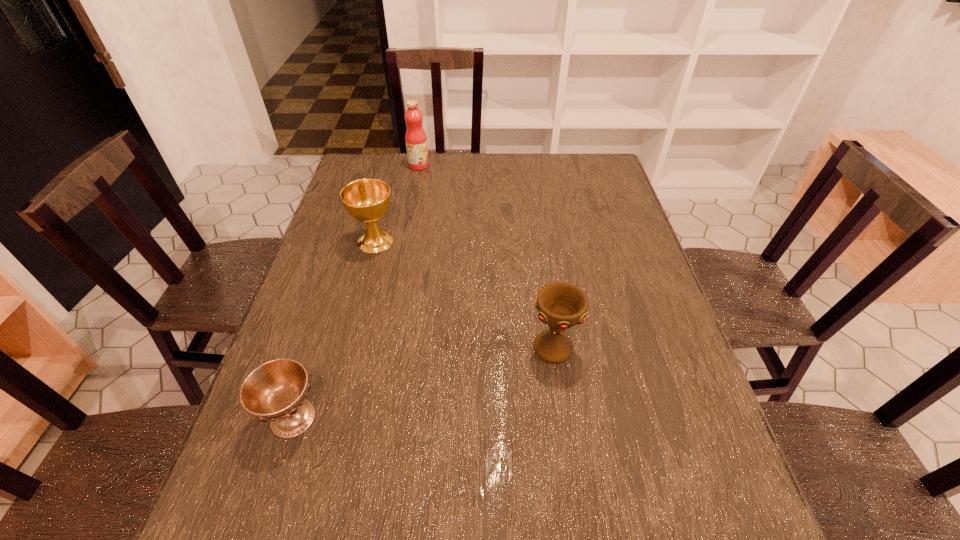
Locate an element on the screen. The width and height of the screenshot is (960, 540). fruit juice is located at coordinates (416, 140).

Find the location of a particular element. Image resolution: width=960 pixels, height=540 pixels. the farthest object is located at coordinates (416, 140).

This screenshot has width=960, height=540. What are the coordinates of `the farthest chalice` in the screenshot? It's located at (367, 200).

The image size is (960, 540). I want to click on the rightmost object, so click(561, 305).

Where is `the rightmost chalice`? The width and height of the screenshot is (960, 540). the rightmost chalice is located at coordinates (561, 305).

What are the coordinates of `the shortest chalice` in the screenshot? It's located at (276, 391).

At what (x,y) coordinates should I click in order to perform the action: click on the shortest object. Please return your answer as a coordinate pair (x, y). Looking at the image, I should click on (276, 391).

You are a GUI agent. You are given a task and a screenshot of the screen. Output one action in this format:
    pyautogui.click(x=<x>, y=<y>)
    Task: Click on the vacant point located 0.170m on the front label of the fruit juice
    This screenshot has height=540, width=960.
    Given the screenshot: What is the action you would take?
    pyautogui.click(x=477, y=165)

In order to click on vacant space positioned on the right of the second farthest object in this screenshot , I will do `click(449, 241)`.

Identify the location of vacant space situated on the left of the second nearest chalice. (360, 349).